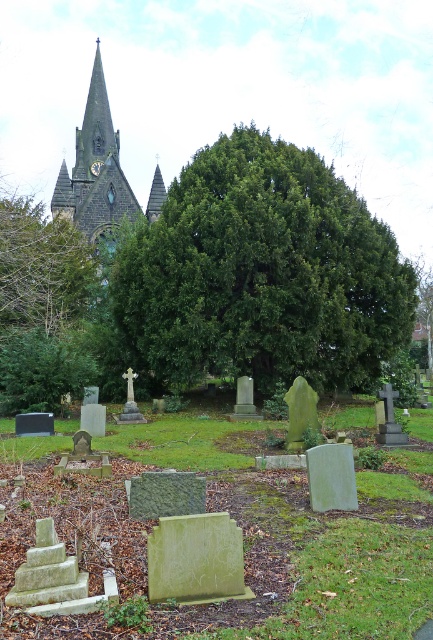
Question: Which is nearer to the green leafy tree at center?

Choices:
 (A) smooth stone church steeple at upper left
 (B) dark gray stone spire at upper center

Answer: (A)

Question: Is green leafy tree at center above dark gray stone spire at upper center?

Choices:
 (A) yes
 (B) no

Answer: (B)

Question: From the image, what is the correct spatial relationship of green leafy tree at center in relation to green leafy tree at upper left?

Choices:
 (A) below
 (B) above

Answer: (B)

Question: Which point is farther from the camera taking this photo?

Choices:
 (A) (0, 246)
 (B) (345, 216)

Answer: (A)

Question: Is green leafy tree at center thinner than dark gray stone spire at upper center?

Choices:
 (A) yes
 (B) no

Answer: (B)

Question: Which object is closer to the camera taking this photo?

Choices:
 (A) smooth stone church steeple at upper left
 (B) green leafy tree at upper left
 (C) green leafy tree at center
 (D) dark gray stone spire at upper center

Answer: (C)